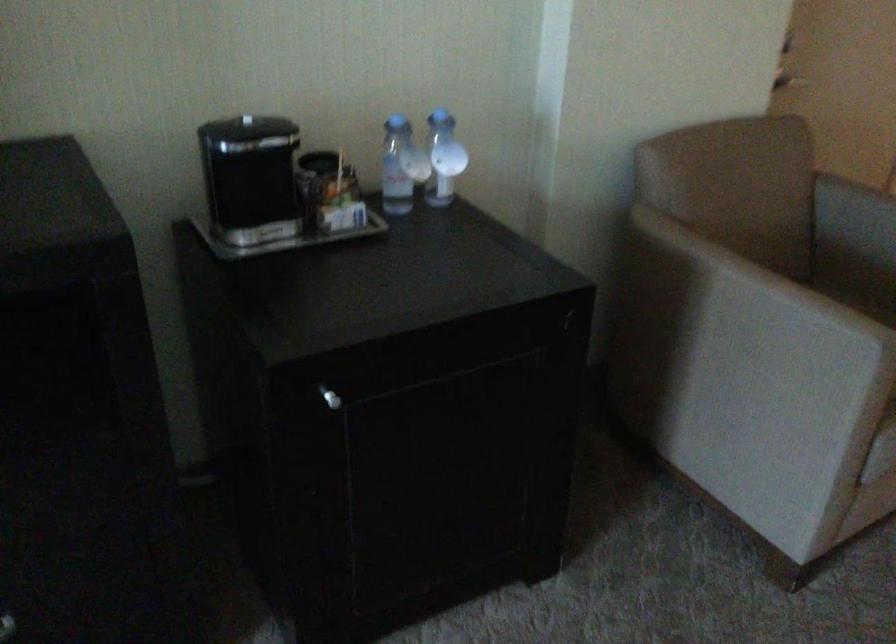
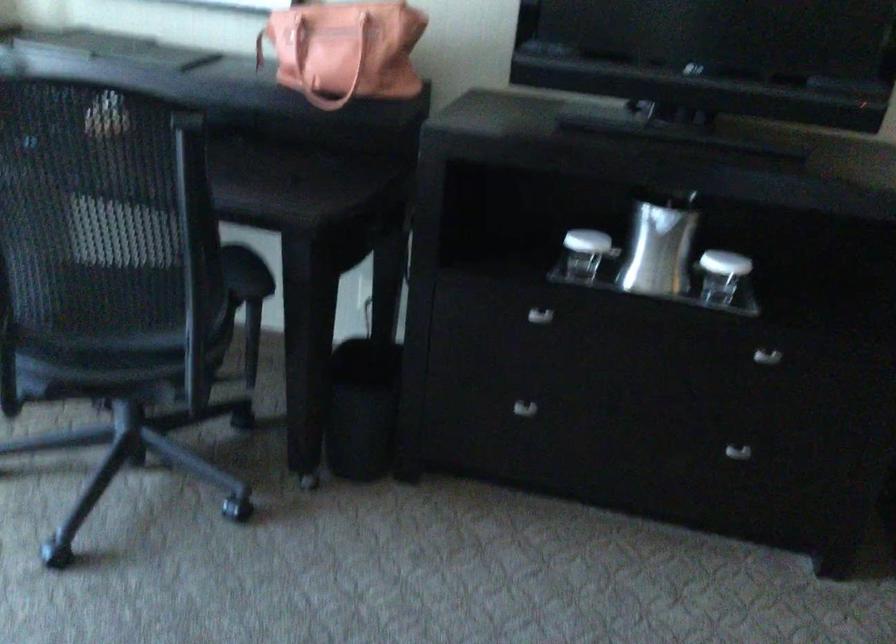
Question: Based on the continuous images, in which direction is the camera rotating? Reply with the corresponding letter.

Choices:
 (A) Left
 (B) Right
 (C) Up
 (D) Down

Answer: (A)